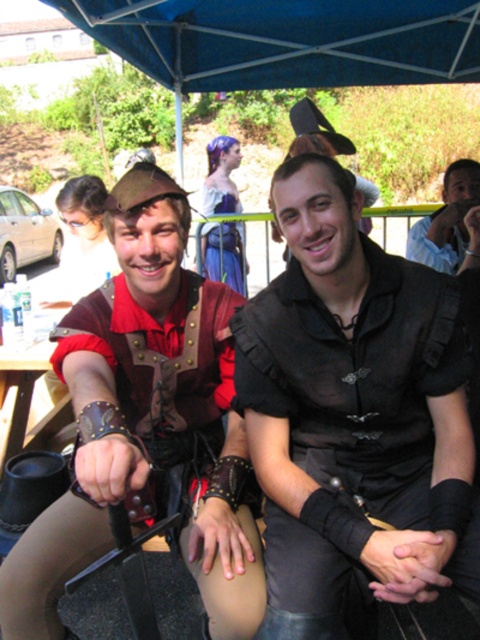
Question: Does leather/golden-brown armor at center come behind blue fabric canopy at upper center?

Choices:
 (A) yes
 (B) no

Answer: (B)

Question: Based on their relative distances, which object is farther from the blue fabric canopy at upper center?

Choices:
 (A) black matte shirt at center
 (B) leather/golden-brown armor at center
 (C) light blue shirt at center
 (D) brown wooden picnic table at lower left

Answer: (A)

Question: Which object appears farthest from the camera in this image?

Choices:
 (A) black matte shirt at center
 (B) leather/golden-brown armor at center
 (C) light blue shirt at center
 (D) brown wooden picnic table at lower left

Answer: (C)

Question: Among these objects, which one is nearest to the camera?

Choices:
 (A) leather/golden-brown armor at center
 (B) light blue shirt at center
 (C) brown wooden picnic table at lower left
 (D) blue fabric canopy at upper center

Answer: (A)

Question: Is blue fabric canopy at upper center closer to camera compared to brown wooden picnic table at lower left?

Choices:
 (A) no
 (B) yes

Answer: (A)

Question: Can you confirm if black matte shirt at center is thinner than light blue shirt at center?

Choices:
 (A) no
 (B) yes

Answer: (A)